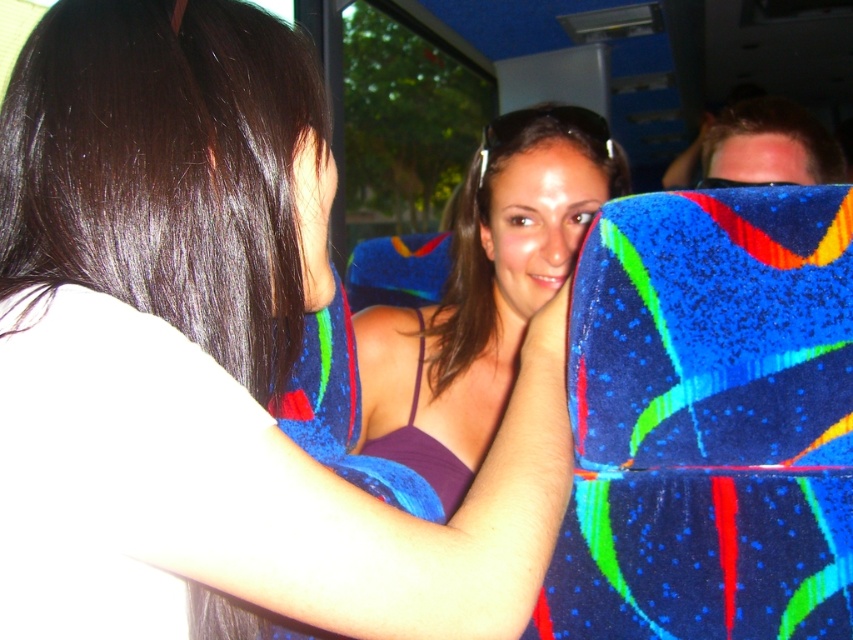
You are a passenger on a bus and want to know if the purple fabric at center is higher than the shiny dark brown hair at upper left. Can you confirm this based on the scene?

The purple fabric at center is taller than shiny dark brown hair at upper left, so yes, the purple fabric at center is higher than the shiny dark brown hair at upper left.

You are a passenger on the bus and want to know which of the two points, point (570, 314) or point (0, 212), is closer to you. Based on the scene description, which point is nearer?

Point (570, 314) is further to the viewer than point (0, 212), so the closer point to you is point (0, 212).